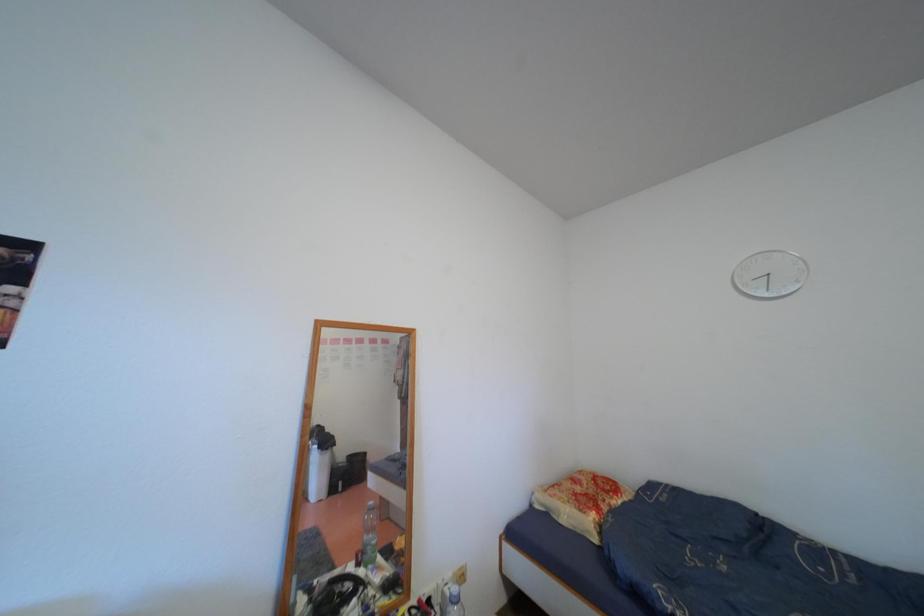
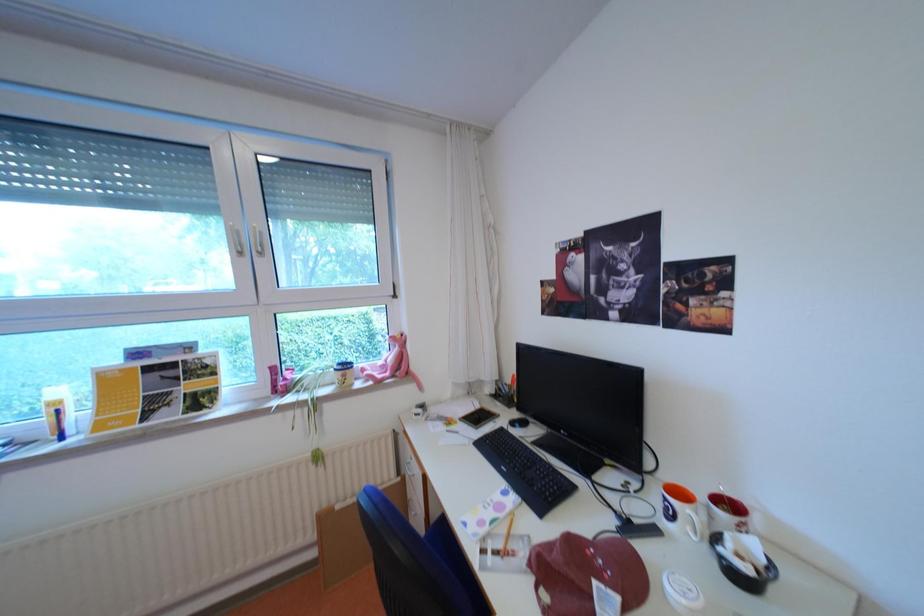
Question: Based on the continuous images, in which direction is the camera rotating? Reply with the corresponding letter.

Choices:
 (A) Left
 (B) Right
 (C) Up
 (D) Down

Answer: (A)